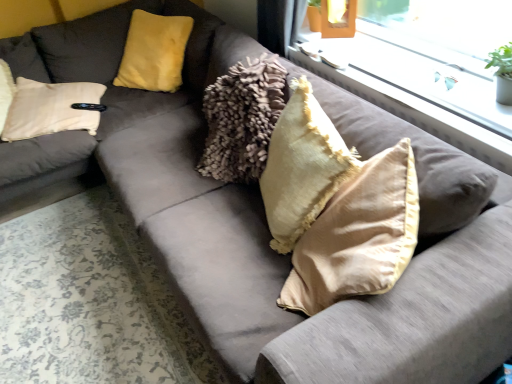
The width and height of the screenshot is (512, 384). What do you see at coordinates (358, 236) in the screenshot? I see `satin beige pillow at center, the 1th pillow in the front-to-back sequence` at bounding box center [358, 236].

The image size is (512, 384). What are the coordinates of `velvet yellow pillow at upper left, which is counted as the third pillow, starting from the front` in the screenshot? It's located at (154, 52).

From the image's perspective, which one is positioned lower, beige velvet pillow at center, which is the second pillow from left to right, or clear glass window at upper center?

beige velvet pillow at center, which is the second pillow from left to right.

Is beige velvet pillow at center, the 2th pillow in the front-to-back sequence, in contact with clear glass window at upper center?

No, beige velvet pillow at center, the 2th pillow in the front-to-back sequence, is not next to clear glass window at upper center.

Based on the photo, between beige velvet pillow at center, which is the second pillow from left to right, and clear glass window at upper center, which one appears on the left side from the viewer's perspective?

beige velvet pillow at center, which is the second pillow from left to right.

Which of these two, beige velvet pillow at center, the 2th pillow viewed from the right, or clear glass window at upper center, is thinner?

Thinner between the two is beige velvet pillow at center, the 2th pillow viewed from the right.

Between beige velvet pillow at center, which is the second pillow from left to right, and velvet yellow pillow at upper left, which appears as the third pillow when viewed from the right, which one has larger size?

With larger size is velvet yellow pillow at upper left, which appears as the third pillow when viewed from the right.

Is beige velvet pillow at center, the 2th pillow viewed from the right, not near velvet yellow pillow at upper left, which is counted as the third pillow, starting from the front?

That's right, there is a large distance between beige velvet pillow at center, the 2th pillow viewed from the right, and velvet yellow pillow at upper left, which is counted as the third pillow, starting from the front.

Based on the photo, between beige velvet pillow at center, the second pillow viewed from the back, and velvet yellow pillow at upper left, the 1th pillow viewed from the left, which one is positioned behind?

velvet yellow pillow at upper left, the 1th pillow viewed from the left, is behind.

In the scene shown: Considering the relative sizes of beige velvet pillow at center, the 2th pillow viewed from the right, and velvet yellow pillow at upper left, the 1th pillow viewed from the left, in the image provided, is beige velvet pillow at center, the 2th pillow viewed from the right, wider than velvet yellow pillow at upper left, the 1th pillow viewed from the left,?

Incorrect, the width of beige velvet pillow at center, the 2th pillow viewed from the right, does not surpass that of velvet yellow pillow at upper left, the 1th pillow viewed from the left.

Is velvet yellow pillow at upper left, the 1th pillow viewed from the left, oriented away from beige velvet pillow at center, the second pillow viewed from the back?

No, velvet yellow pillow at upper left, the 1th pillow viewed from the left, is not facing the opposite direction of beige velvet pillow at center, the second pillow viewed from the back.

From a real-world perspective, is velvet yellow pillow at upper left, which is counted as the third pillow, starting from the front, positioned over beige velvet pillow at center, the 2th pillow in the front-to-back sequence, based on gravity?

Indeed, from a real-world perspective, velvet yellow pillow at upper left, which is counted as the third pillow, starting from the front, stands above beige velvet pillow at center, the 2th pillow in the front-to-back sequence.

Locate an element on the screen. This screenshot has height=384, width=512. pillow located behind the beige velvet pillow at center, which is the second pillow from left to right is located at coordinates (154, 52).

Are velvet yellow pillow at upper left, which is counted as the third pillow, starting from the front, and beige velvet pillow at center, the 2th pillow in the front-to-back sequence, beside each other?

There is a gap between velvet yellow pillow at upper left, which is counted as the third pillow, starting from the front, and beige velvet pillow at center, the 2th pillow in the front-to-back sequence.

Is the depth of satin beige pillow at center, the first pillow in the right-to-left sequence, less than that of beige velvet pillow at center, the 2th pillow viewed from the right?

Yes, it is in front of beige velvet pillow at center, the 2th pillow viewed from the right.

Is satin beige pillow at center, the third pillow in the left-to-right sequence, oriented away from beige velvet pillow at center, the second pillow viewed from the back?

No, satin beige pillow at center, the third pillow in the left-to-right sequence, is not facing the opposite direction of beige velvet pillow at center, the second pillow viewed from the back.

Considering the sizes of objects satin beige pillow at center, the 3th pillow positioned from the back, and beige velvet pillow at center, the 2th pillow in the front-to-back sequence, in the image provided, who is taller, satin beige pillow at center, the 3th pillow positioned from the back, or beige velvet pillow at center, the 2th pillow in the front-to-back sequence,?

satin beige pillow at center, the 3th pillow positioned from the back.

Is satin beige pillow at center, the 3th pillow positioned from the back, positioned far away from beige velvet pillow at center, the 2th pillow viewed from the right?

satin beige pillow at center, the 3th pillow positioned from the back, is actually quite close to beige velvet pillow at center, the 2th pillow viewed from the right.

Is clear glass window at upper center to the left or to the right of beige velvet pillow at center, the 2th pillow viewed from the right, in the image?

Based on their positions, clear glass window at upper center is located to the right of beige velvet pillow at center, the 2th pillow viewed from the right.

Which is behind, point (377, 78) or point (283, 129)?

Positioned behind is point (377, 78).

From the image's perspective, is clear glass window at upper center under beige velvet pillow at center, the 2th pillow in the front-to-back sequence?

No.

Is clear glass window at upper center positioned before beige velvet pillow at center, which is the second pillow from left to right?

No, clear glass window at upper center is further to the viewer.

Is the surface of velvet yellow pillow at upper left, which is counted as the third pillow, starting from the front, in direct contact with satin beige pillow at center, the third pillow in the left-to-right sequence?

No, velvet yellow pillow at upper left, which is counted as the third pillow, starting from the front, is not touching satin beige pillow at center, the third pillow in the left-to-right sequence.

In terms of width, does velvet yellow pillow at upper left, which is counted as the third pillow, starting from the front, look wider or thinner when compared to satin beige pillow at center, the first pillow in the right-to-left sequence?

Considering their sizes, velvet yellow pillow at upper left, which is counted as the third pillow, starting from the front, looks broader than satin beige pillow at center, the first pillow in the right-to-left sequence.

Is velvet yellow pillow at upper left, which appears as the third pillow when viewed from the right, looking in the opposite direction of satin beige pillow at center, the first pillow in the right-to-left sequence?

That's not correct — velvet yellow pillow at upper left, which appears as the third pillow when viewed from the right, is not looking away from satin beige pillow at center, the first pillow in the right-to-left sequence.

Can you tell me how much clear glass window at upper center and velvet yellow pillow at upper left, which appears as the third pillow when viewed from the right, differ in facing direction?

The facing directions of clear glass window at upper center and velvet yellow pillow at upper left, which appears as the third pillow when viewed from the right, are 33.1 degrees apart.

Does point (368, 45) come farther from viewer compared to point (176, 44)?

No, (368, 45) is in front of (176, 44).

The width and height of the screenshot is (512, 384). What are the coordinates of `window on the right of velvet yellow pillow at upper left, which is counted as the third pillow, starting from the front` in the screenshot? It's located at (423, 66).

Does clear glass window at upper center have a greater height compared to velvet yellow pillow at upper left, which appears as the first pillow when viewed from the back?

In fact, clear glass window at upper center may be shorter than velvet yellow pillow at upper left, which appears as the first pillow when viewed from the back.

The height and width of the screenshot is (384, 512). I want to click on window positioned vertically above the beige velvet pillow at center, the second pillow viewed from the back (from a real-world perspective), so click(x=423, y=66).

Find the location of `pillow behind the beige velvet pillow at center, the 2th pillow viewed from the right`. pillow behind the beige velvet pillow at center, the 2th pillow viewed from the right is located at coordinates (154, 52).

Estimate the real-world distances between objects in this image. Which object is closer to clear glass window at upper center, velvet yellow pillow at upper left, which is counted as the third pillow, starting from the front, or satin beige pillow at center, the 1th pillow in the front-to-back sequence?

satin beige pillow at center, the 1th pillow in the front-to-back sequence, is closer to clear glass window at upper center.

Considering their positions, is velvet yellow pillow at upper left, which appears as the first pillow when viewed from the back, positioned further to satin beige pillow at center, the 3th pillow positioned from the back, than beige velvet pillow at center, the 2th pillow viewed from the right?

Among the two, velvet yellow pillow at upper left, which appears as the first pillow when viewed from the back, is located further to satin beige pillow at center, the 3th pillow positioned from the back.

Consider the image. When comparing their distances from velvet yellow pillow at upper left, which is counted as the third pillow, starting from the front, does satin beige pillow at center, the first pillow in the right-to-left sequence, or beige velvet pillow at center, the 2th pillow in the front-to-back sequence, seem closer?

Among the two, beige velvet pillow at center, the 2th pillow in the front-to-back sequence, is located nearer to velvet yellow pillow at upper left, which is counted as the third pillow, starting from the front.

Which object lies further to the anchor point beige velvet pillow at center, which is the second pillow from left to right, satin beige pillow at center, the third pillow in the left-to-right sequence, or clear glass window at upper center?

Among the two, clear glass window at upper center is located further to beige velvet pillow at center, which is the second pillow from left to right.

Looking at the image, which one is located closer to clear glass window at upper center, satin beige pillow at center, the 1th pillow in the front-to-back sequence, or velvet yellow pillow at upper left, which is counted as the third pillow, starting from the front?

satin beige pillow at center, the 1th pillow in the front-to-back sequence.

In the scene shown: From the image, which object appears to be nearer to velvet yellow pillow at upper left, which is counted as the third pillow, starting from the front, beige velvet pillow at center, the 2th pillow viewed from the right, or satin beige pillow at center, the 3th pillow positioned from the back?

beige velvet pillow at center, the 2th pillow viewed from the right, is positioned closer to the anchor velvet yellow pillow at upper left, which is counted as the third pillow, starting from the front.

Estimate the real-world distances between objects in this image. Which object is further from beige velvet pillow at center, the 2th pillow viewed from the right, velvet yellow pillow at upper left, which is counted as the third pillow, starting from the front, or clear glass window at upper center?

velvet yellow pillow at upper left, which is counted as the third pillow, starting from the front, is positioned further to the anchor beige velvet pillow at center, the 2th pillow viewed from the right.

Considering their positions, is clear glass window at upper center positioned closer to satin beige pillow at center, the 3th pillow positioned from the back, than beige velvet pillow at center, the second pillow viewed from the back?

beige velvet pillow at center, the second pillow viewed from the back, is closer to satin beige pillow at center, the 3th pillow positioned from the back.

The width and height of the screenshot is (512, 384). Find the location of `pillow between clear glass window at upper center and satin beige pillow at center, the 3th pillow positioned from the back, in the vertical direction`. pillow between clear glass window at upper center and satin beige pillow at center, the 3th pillow positioned from the back, in the vertical direction is located at coordinates (302, 167).

Locate an element on the screen. window positioned between satin beige pillow at center, the 1th pillow in the front-to-back sequence, and velvet yellow pillow at upper left, which appears as the first pillow when viewed from the back, from near to far is located at coordinates (423, 66).

You are a GUI agent. You are given a task and a screenshot of the screen. Output one action in this format:
    pyautogui.click(x=<x>, y=<y>)
    Task: Click on the pillow located between satin beige pillow at center, the 3th pillow positioned from the back, and velvet yellow pillow at upper left, which appears as the first pillow when viewed from the back, in the depth direction
    The width and height of the screenshot is (512, 384).
    Given the screenshot: What is the action you would take?
    [x=302, y=167]